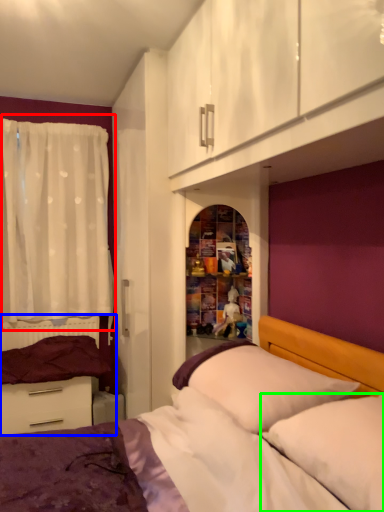
Question: Estimate the real-world distances between objects in this image. Which object is farther from curtain (highlighted by a red box), bed frame (highlighted by a blue box) or pillow (highlighted by a green box)?

Choices:
 (A) bed frame
 (B) pillow

Answer: (B)